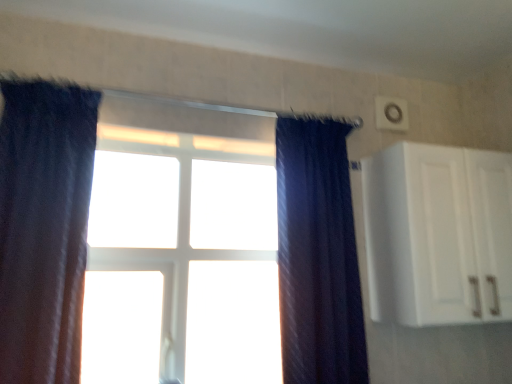
Question: From the image's perspective, is white matte cabinet at upper right below dark blue textured curtain at center, the second curtain from the left?

Choices:
 (A) yes
 (B) no

Answer: (B)

Question: Does white matte cabinet at upper right have a lesser height compared to dark blue textured curtain at center, the second curtain from the left?

Choices:
 (A) yes
 (B) no

Answer: (A)

Question: Is white matte cabinet at upper right bigger than dark blue textured curtain at center, the second curtain from the left?

Choices:
 (A) no
 (B) yes

Answer: (B)

Question: Is dark blue textured curtain at center, acting as the 1th curtain starting from the right, surrounded by white matte cabinet at upper right?

Choices:
 (A) yes
 (B) no

Answer: (B)

Question: Is white matte cabinet at upper right taller than dark blue textured curtain at center, the second curtain from the left?

Choices:
 (A) yes
 (B) no

Answer: (B)

Question: Considering the positions of point (303, 132) and point (130, 231), is point (303, 132) closer or farther from the camera than point (130, 231)?

Choices:
 (A) farther
 (B) closer

Answer: (B)

Question: In terms of width, does dark blue textured curtain at center, the second curtain from the left, look wider or thinner when compared to white plastic window at center?

Choices:
 (A) wide
 (B) thin

Answer: (A)

Question: In terms of height, does dark blue textured curtain at center, the second curtain from the left, look taller or shorter compared to white plastic window at center?

Choices:
 (A) short
 (B) tall

Answer: (B)

Question: Is dark blue textured curtain at center, acting as the 1th curtain starting from the right, in front of or behind white plastic window at center in the image?

Choices:
 (A) behind
 (B) front

Answer: (B)

Question: Based on their sizes in the image, would you say white plastic window at center is bigger or smaller than white matte cabinet at upper right?

Choices:
 (A) small
 (B) big

Answer: (A)

Question: From a real-world perspective, is white plastic window at center physically located above or below white matte cabinet at upper right?

Choices:
 (A) above
 (B) below

Answer: (B)

Question: Based on their positions, is white plastic window at center located to the left or right of white matte cabinet at upper right?

Choices:
 (A) right
 (B) left

Answer: (B)

Question: Considering their positions, is white plastic window at center located in front of or behind white matte cabinet at upper right?

Choices:
 (A) behind
 (B) front

Answer: (A)

Question: From the image's perspective, is dark blue velvet curtain at left, which is the first curtain from left to right, above or below dark blue textured curtain at center, the second curtain from the left?

Choices:
 (A) above
 (B) below

Answer: (A)

Question: Is dark blue velvet curtain at left, the 2th curtain from the right, in front of or behind dark blue textured curtain at center, acting as the 1th curtain starting from the right, in the image?

Choices:
 (A) front
 (B) behind

Answer: (A)